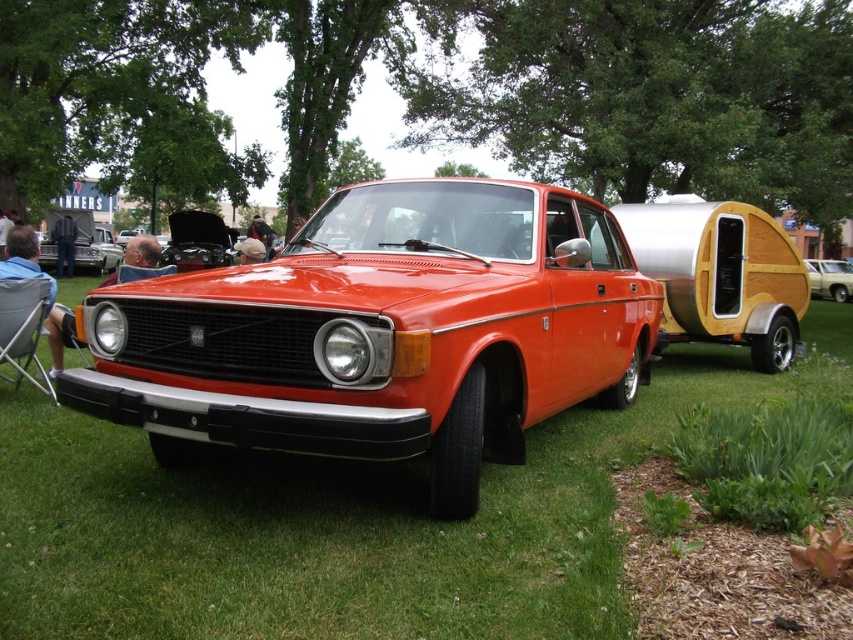
Does glossy orange car at center come behind denim pants at left?

No, it is not.

Between point (561, 224) and point (73, 220), which one is positioned behind?

Positioned behind is point (73, 220).

Between point (532, 376) and point (61, 257), which one is positioned in front?

Point (532, 376) is in front.

You are a GUI agent. You are given a task and a screenshot of the screen. Output one action in this format:
    pyautogui.click(x=<x>, y=<y>)
    Task: Click on the glossy orange car at center
    The width and height of the screenshot is (853, 640).
    Given the screenshot: What is the action you would take?
    pyautogui.click(x=383, y=332)

Looking at this image, between glossy orange car at center and wooden trailer at right, which one appears on the left side from the viewer's perspective?

From the viewer's perspective, glossy orange car at center appears more on the left side.

The height and width of the screenshot is (640, 853). In order to click on glossy orange car at center in this screenshot , I will do `click(383, 332)`.

Is point (460, 486) positioned after point (47, 305)?

No.

Can you confirm if glossy orange car at center is positioned to the right of blue denim jeans at lower left?

Yes, glossy orange car at center is to the right of blue denim jeans at lower left.

This screenshot has height=640, width=853. Describe the element at coordinates (383, 332) in the screenshot. I see `glossy orange car at center` at that location.

Where is `glossy orange car at center`? glossy orange car at center is located at coordinates (383, 332).